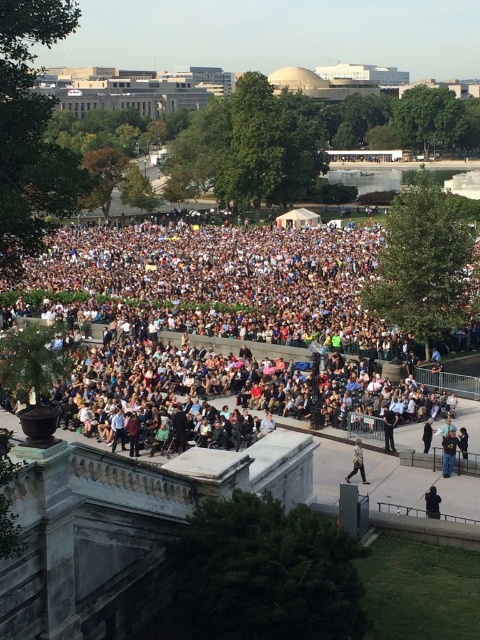
Can you confirm if denim jacket at lower right is wider than black fabric jacket at center?

Indeed, denim jacket at lower right has a greater width compared to black fabric jacket at center.

Which is above, denim jacket at lower right or black fabric jacket at center?

black fabric jacket at center is higher up.

Does point (446, 444) lie behind point (391, 442)?

No, it is in front of (391, 442).

Locate an element on the screen. The width and height of the screenshot is (480, 640). denim jacket at lower right is located at coordinates (448, 452).

Where is `denim jacket at lower right`? denim jacket at lower right is located at coordinates (448, 452).

Which is behind, point (455, 438) or point (349, 474)?

Positioned behind is point (455, 438).

Find the location of `denim jacket at lower right`. denim jacket at lower right is located at coordinates (448, 452).

Is light brown leather jacket at lower center above black leather jacket at lower right?

Correct, light brown leather jacket at lower center is located above black leather jacket at lower right.

Does point (359, 468) come in front of point (435, 497)?

No, (359, 468) is behind (435, 497).

Locate an element on the screen. light brown leather jacket at lower center is located at coordinates (358, 461).